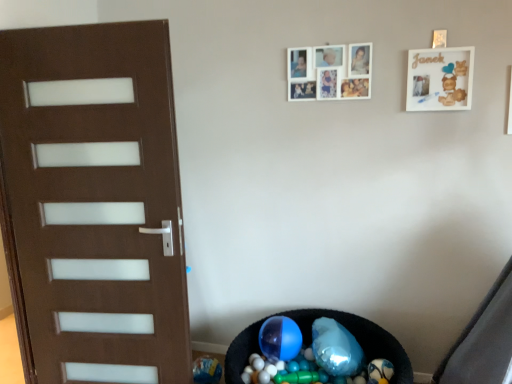
The image size is (512, 384). In order to click on white matte picture frame at upper right, which appears as the second picture frame when viewed from the left in this screenshot , I will do `click(440, 79)`.

The height and width of the screenshot is (384, 512). In order to click on white matte picture frame at upper center, acting as the second picture frame starting from the right in this screenshot , I will do `click(329, 72)`.

Which of these two, white matte picture frame at upper right, which appears as the second picture frame when viewed from the left, or translucent plastic balls at lower center, is smaller?

Smaller between the two is white matte picture frame at upper right, which appears as the second picture frame when viewed from the left.

Is white matte picture frame at upper right, which appears as the second picture frame when viewed from the left, not within translucent plastic balls at lower center?

Yes, white matte picture frame at upper right, which appears as the second picture frame when viewed from the left, is not within translucent plastic balls at lower center.

From the image's perspective, which object appears higher, white matte picture frame at upper right, the first picture frame viewed from the right, or translucent plastic balls at lower center?

white matte picture frame at upper right, the first picture frame viewed from the right, appears higher in the image.

Is white matte picture frame at upper right, which appears as the second picture frame when viewed from the left, turned away from translucent plastic balls at lower center?

white matte picture frame at upper right, which appears as the second picture frame when viewed from the left, is not turned away from translucent plastic balls at lower center.

Is white matte picture frame at upper center, acting as the second picture frame starting from the right, far away from translucent plastic balls at lower center?

Yes, white matte picture frame at upper center, acting as the second picture frame starting from the right, and translucent plastic balls at lower center are located far from each other.

Do you think white matte picture frame at upper center, acting as the second picture frame starting from the right, is within translucent plastic balls at lower center, or outside of it?

white matte picture frame at upper center, acting as the second picture frame starting from the right, cannot be found inside translucent plastic balls at lower center.

Is white matte picture frame at upper center, acting as the second picture frame starting from the right, positioned with its back to translucent plastic balls at lower center?

That's not correct — white matte picture frame at upper center, acting as the second picture frame starting from the right, is not looking away from translucent plastic balls at lower center.

I want to click on the 2nd picture frame behind the translucent plastic balls at lower center, so click(329, 72).

Locate an element on the screen. the 1st picture frame above when counting from the translucent plastic balls at lower center (from the image's perspective) is located at coordinates (440, 79).

From the picture: Is white matte picture frame at upper right, which appears as the second picture frame when viewed from the left, located within translucent plastic balls at lower center?

No, translucent plastic balls at lower center does not contain white matte picture frame at upper right, which appears as the second picture frame when viewed from the left.

Does translucent plastic balls at lower center lie in front of white matte picture frame at upper right, which appears as the second picture frame when viewed from the left?

Yes, translucent plastic balls at lower center is closer to the viewer.

From a real-world perspective, between translucent plastic balls at lower center and white matte picture frame at upper right, the first picture frame viewed from the right, who is vertically higher?

white matte picture frame at upper right, the first picture frame viewed from the right, from a real-world perspective.

Consider the image. Is white matte picture frame at upper center, acting as the second picture frame starting from the right, positioned beyond the bounds of white matte picture frame at upper right, the first picture frame viewed from the right?

Yes, white matte picture frame at upper center, acting as the second picture frame starting from the right, is outside of white matte picture frame at upper right, the first picture frame viewed from the right.

Is point (303, 93) farther from camera compared to point (449, 48)?

Yes, point (303, 93) is behind point (449, 48).

Considering the relative sizes of white matte picture frame at upper center, which is the first picture frame from left to right, and white matte picture frame at upper right, the first picture frame viewed from the right, in the image provided, is white matte picture frame at upper center, which is the first picture frame from left to right, thinner than white matte picture frame at upper right, the first picture frame viewed from the right,?

Indeed, white matte picture frame at upper center, which is the first picture frame from left to right, has a lesser width compared to white matte picture frame at upper right, the first picture frame viewed from the right.

Would you say translucent plastic balls at lower center is a long distance from white matte picture frame at upper center, which is the first picture frame from left to right?

Indeed, translucent plastic balls at lower center is not near white matte picture frame at upper center, which is the first picture frame from left to right.

Can you confirm if translucent plastic balls at lower center is thinner than white matte picture frame at upper center, acting as the second picture frame starting from the right?

In fact, translucent plastic balls at lower center might be wider than white matte picture frame at upper center, acting as the second picture frame starting from the right.

Considering the relative positions of translucent plastic balls at lower center and white matte picture frame at upper center, which is the first picture frame from left to right, in the image provided, is translucent plastic balls at lower center behind white matte picture frame at upper center, which is the first picture frame from left to right,?

No, translucent plastic balls at lower center is closer to the camera.

Considering the positions of points (320, 358) and (336, 50), is point (320, 358) farther from camera compared to point (336, 50)?

Yes, it is behind point (336, 50).

From a real-world perspective, is white matte picture frame at upper right, the first picture frame viewed from the right, positioned over white matte picture frame at upper center, which is the first picture frame from left to right, based on gravity?

Actually, white matte picture frame at upper right, the first picture frame viewed from the right, is physically below white matte picture frame at upper center, which is the first picture frame from left to right, in the real world.

You are a GUI agent. You are given a task and a screenshot of the screen. Output one action in this format:
    pyautogui.click(x=<x>, y=<y>)
    Task: Click on the picture frame lying above the white matte picture frame at upper right, which appears as the second picture frame when viewed from the left (from the image's perspective)
    The image size is (512, 384).
    Given the screenshot: What is the action you would take?
    pyautogui.click(x=329, y=72)

Consider the image. Which object is more forward, white matte picture frame at upper right, which appears as the second picture frame when viewed from the left, or white matte picture frame at upper center, acting as the second picture frame starting from the right?

white matte picture frame at upper right, which appears as the second picture frame when viewed from the left, is in front.

Where is `garbage below the white matte picture frame at upper right, which appears as the second picture frame when viewed from the left (from a real-world perspective)`? This screenshot has height=384, width=512. garbage below the white matte picture frame at upper right, which appears as the second picture frame when viewed from the left (from a real-world perspective) is located at coordinates [312, 355].

The image size is (512, 384). I want to click on garbage below the white matte picture frame at upper center, which is the first picture frame from left to right (from the image's perspective), so click(x=312, y=355).

From the image, which object appears to be nearer to white matte picture frame at upper center, which is the first picture frame from left to right, white matte picture frame at upper right, which appears as the second picture frame when viewed from the left, or translucent plastic balls at lower center?

white matte picture frame at upper right, which appears as the second picture frame when viewed from the left, lies closer to white matte picture frame at upper center, which is the first picture frame from left to right, than the other object.

Which object lies nearer to the anchor point white matte picture frame at upper right, the first picture frame viewed from the right, translucent plastic balls at lower center or white matte picture frame at upper center, which is the first picture frame from left to right?

white matte picture frame at upper center, which is the first picture frame from left to right, is closer to white matte picture frame at upper right, the first picture frame viewed from the right.

Consider the image. Looking at the image, which one is located closer to white matte picture frame at upper center, which is the first picture frame from left to right, translucent plastic balls at lower center or white matte picture frame at upper right, which appears as the second picture frame when viewed from the left?

white matte picture frame at upper right, which appears as the second picture frame when viewed from the left, lies closer to white matte picture frame at upper center, which is the first picture frame from left to right, than the other object.

Looking at the image, which one is located further to white matte picture frame at upper right, which appears as the second picture frame when viewed from the left, white matte picture frame at upper center, acting as the second picture frame starting from the right, or translucent plastic balls at lower center?

The object further to white matte picture frame at upper right, which appears as the second picture frame when viewed from the left, is translucent plastic balls at lower center.

Which object lies nearer to the anchor point translucent plastic balls at lower center, white matte picture frame at upper center, which is the first picture frame from left to right, or white matte picture frame at upper right, the first picture frame viewed from the right?

white matte picture frame at upper center, which is the first picture frame from left to right, lies closer to translucent plastic balls at lower center than the other object.

From the image, which object appears to be nearer to translucent plastic balls at lower center, white matte picture frame at upper right, which appears as the second picture frame when viewed from the left, or white matte picture frame at upper center, acting as the second picture frame starting from the right?

white matte picture frame at upper center, acting as the second picture frame starting from the right, lies closer to translucent plastic balls at lower center than the other object.

Locate an element on the screen. The height and width of the screenshot is (384, 512). picture frame that lies between white matte picture frame at upper center, acting as the second picture frame starting from the right, and translucent plastic balls at lower center from top to bottom is located at coordinates (440, 79).